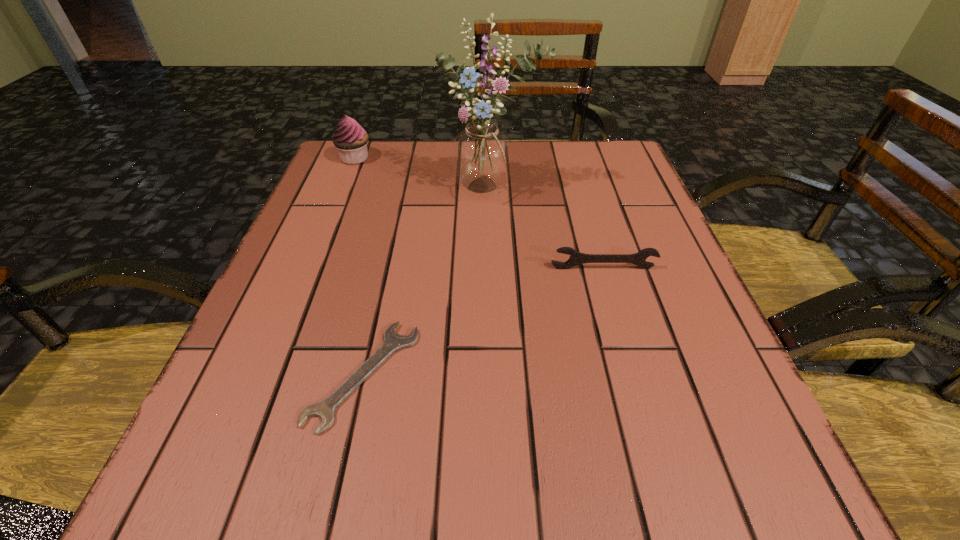
Where is `free space located on the open ends of the farther wrench`? free space located on the open ends of the farther wrench is located at coordinates (663, 473).

This screenshot has height=540, width=960. Identify the location of vacant area situated 0.200m on the back of the third object from right to left. (393, 246).

Locate an element on the screen. The height and width of the screenshot is (540, 960). bouquet that is at the far edge is located at coordinates (481, 154).

The height and width of the screenshot is (540, 960). I want to click on cupcake at the far edge, so click(x=350, y=139).

Where is `cupcake that is at the left edge`? The image size is (960, 540). cupcake that is at the left edge is located at coordinates click(350, 139).

This screenshot has width=960, height=540. What are the coordinates of `wrench present at the left edge` in the screenshot? It's located at (325, 409).

The width and height of the screenshot is (960, 540). In order to click on object at the right edge in this screenshot , I will do `click(576, 258)`.

I want to click on object that is at the far left corner, so click(350, 139).

Locate an element on the screen. The width and height of the screenshot is (960, 540). free region at the far edge of the desktop is located at coordinates (536, 185).

Find the location of a particular element. The height and width of the screenshot is (540, 960). vacant space at the near edge of the desktop is located at coordinates (356, 466).